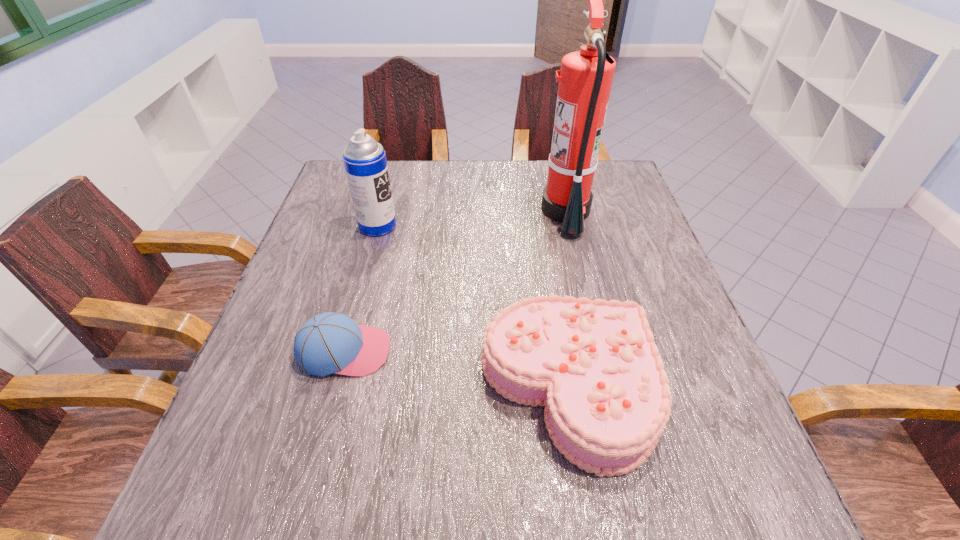
At what (x,y) coordinates should I click in order to perform the action: click on free space at the left edge of the desktop. Please return your answer as a coordinate pair (x, y). The image size is (960, 540). Looking at the image, I should click on (335, 303).

Locate an element on the screen. vacant space at the right edge of the desktop is located at coordinates (672, 345).

Locate an element on the screen. free space at the near left corner of the desktop is located at coordinates (276, 485).

Where is `free space at the far right corner`? Image resolution: width=960 pixels, height=540 pixels. free space at the far right corner is located at coordinates (630, 184).

Where is `vacant area at the near right corner`? Image resolution: width=960 pixels, height=540 pixels. vacant area at the near right corner is located at coordinates coord(757,491).

Identify the location of free space that is in between the baseball cap and the tallest object. (455, 281).

Locate an element on the screen. The height and width of the screenshot is (540, 960). free space between the baseball cap and the second tallest object is located at coordinates (361, 288).

You are a GUI agent. You are given a task and a screenshot of the screen. Output one action in this format:
    pyautogui.click(x=<x>, y=<y>)
    Task: Click on the vacant space in between the aerosol can and the fire extinguisher
    The height and width of the screenshot is (540, 960).
    Given the screenshot: What is the action you would take?
    (472, 218)

Where is `free point between the aerosol can and the baseball cap`? The height and width of the screenshot is (540, 960). free point between the aerosol can and the baseball cap is located at coordinates (361, 288).

Locate an element on the screen. This screenshot has width=960, height=540. vacant area between the aerosol can and the cake is located at coordinates (473, 307).